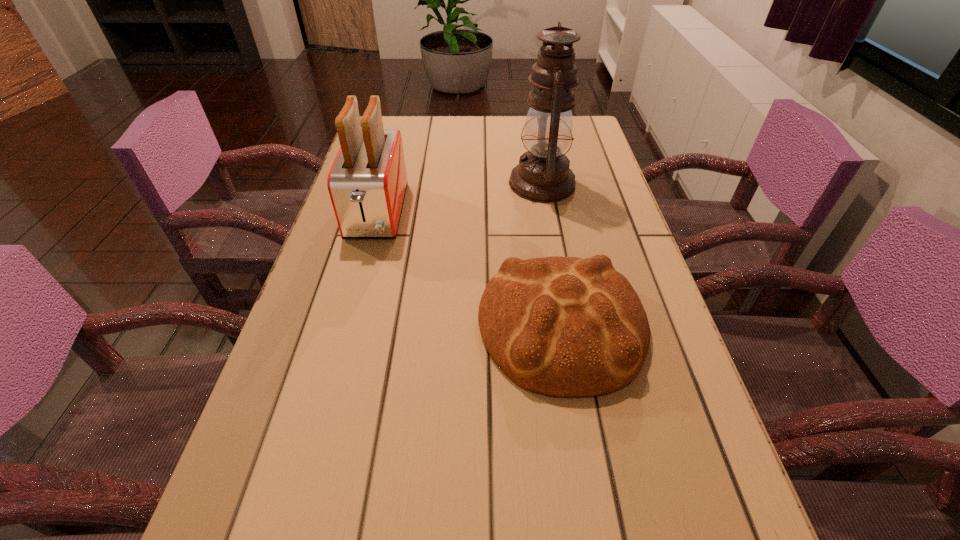
This screenshot has height=540, width=960. In order to click on bread situated at the right edge in this screenshot , I will do `click(566, 327)`.

In the image, there is a desktop. Find the location of `vacant space at the far edge`. vacant space at the far edge is located at coordinates (521, 123).

In the image, there is a desktop. Where is `blank space at the left edge`? Image resolution: width=960 pixels, height=540 pixels. blank space at the left edge is located at coordinates (286, 373).

Image resolution: width=960 pixels, height=540 pixels. I want to click on vacant space at the right edge of the desktop, so click(x=702, y=422).

Locate an element on the screen. Image resolution: width=960 pixels, height=540 pixels. vacant point at the far left corner is located at coordinates pos(406,119).

Where is `vacant space that's between the tallest object and the bread`? This screenshot has height=540, width=960. vacant space that's between the tallest object and the bread is located at coordinates (552, 254).

You are a GUI agent. You are given a task and a screenshot of the screen. Output one action in this format:
    pyautogui.click(x=<x>, y=<y>)
    Task: Click on the vacant area that lies between the toaster and the tallest object
    This screenshot has height=540, width=960.
    Given the screenshot: What is the action you would take?
    pyautogui.click(x=460, y=198)

Locate an element on the screen. The image size is (960, 540). unoccupied position between the oil lamp and the leftmost object is located at coordinates (460, 198).

Locate an element on the screen. This screenshot has width=960, height=540. free space between the tallest object and the nearest object is located at coordinates (552, 254).

The width and height of the screenshot is (960, 540). I want to click on object that is the second closest to the second shortest object, so click(543, 175).